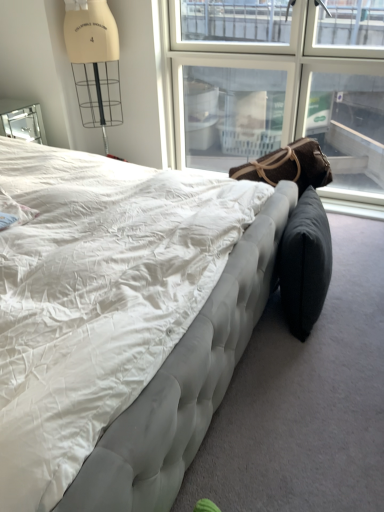
Identify the location of black fabric bean bag chair at lower right, the 2th bean bag chair from the top. (304, 264).

Describe the element at coordinates (304, 264) in the screenshot. I see `black fabric bean bag chair at lower right, the 2th bean bag chair from the top` at that location.

Locate an element on the screen. Image resolution: width=384 pixels, height=512 pixels. tufted fabric bed at center is located at coordinates (102, 297).

Where is `brown fabric bean bag at center, the 1th bean bag chair viewed from the top`? This screenshot has height=512, width=384. brown fabric bean bag at center, the 1th bean bag chair viewed from the top is located at coordinates (289, 166).

Is tufted fabric bed at center completely or partially outside of black fabric bean bag chair at lower right, the 2th bean bag chair from the top?

Indeed, tufted fabric bed at center is completely outside black fabric bean bag chair at lower right, the 2th bean bag chair from the top.

Is point (104, 366) positioned after point (281, 271)?

No, it is in front of (281, 271).

From a real-world perspective, starting from the tufted fabric bed at center, which bean bag chair is the 2nd one below it? Please provide its 2D coordinates.

[(304, 264)]

In the scene shown: Is tufted fabric bed at center positioned with its back to black fabric bean bag chair at lower right, arranged as the first bean bag chair when ordered from the bottom?

No, tufted fabric bed at center is not facing away from black fabric bean bag chair at lower right, arranged as the first bean bag chair when ordered from the bottom.

Does black fabric bean bag chair at lower right, the 2th bean bag chair from the top, have a larger size compared to transparent glass window at upper right?

No, black fabric bean bag chair at lower right, the 2th bean bag chair from the top, is not bigger than transparent glass window at upper right.

In the image, is black fabric bean bag chair at lower right, arranged as the first bean bag chair when ordered from the bottom, on the left side or the right side of transparent glass window at upper right?

From the image, it's evident that black fabric bean bag chair at lower right, arranged as the first bean bag chair when ordered from the bottom, is to the right of transparent glass window at upper right.

Is black fabric bean bag chair at lower right, the 2th bean bag chair from the top, facing away from transparent glass window at upper right?

No, black fabric bean bag chair at lower right, the 2th bean bag chair from the top, is not facing away from transparent glass window at upper right.

Do you think black fabric bean bag chair at lower right, the 2th bean bag chair from the top, is within transparent glass window at upper right, or outside of it?

black fabric bean bag chair at lower right, the 2th bean bag chair from the top, exists outside the volume of transparent glass window at upper right.

Is tufted fabric bed at center positioned with its back to brown fabric bean bag at center, the 1th bean bag chair viewed from the top?

That's not correct — tufted fabric bed at center is not looking away from brown fabric bean bag at center, the 1th bean bag chair viewed from the top.

Is tufted fabric bed at center wider or thinner than brown fabric bean bag at center, which ranks as the second bean bag chair in bottom-to-top order?

In the image, tufted fabric bed at center appears to be wider than brown fabric bean bag at center, which ranks as the second bean bag chair in bottom-to-top order.

Is tufted fabric bed at center taller or shorter than brown fabric bean bag at center, which ranks as the second bean bag chair in bottom-to-top order?

In the image, tufted fabric bed at center appears to be taller than brown fabric bean bag at center, which ranks as the second bean bag chair in bottom-to-top order.

Are brown fabric bean bag at center, which ranks as the second bean bag chair in bottom-to-top order, and tufted fabric bed at center making contact?

No, brown fabric bean bag at center, which ranks as the second bean bag chair in bottom-to-top order, is not with tufted fabric bed at center.

Considering the sizes of brown fabric bean bag at center, which ranks as the second bean bag chair in bottom-to-top order, and tufted fabric bed at center in the image, is brown fabric bean bag at center, which ranks as the second bean bag chair in bottom-to-top order, taller or shorter than tufted fabric bed at center?

Considering their sizes, brown fabric bean bag at center, which ranks as the second bean bag chair in bottom-to-top order, has less height than tufted fabric bed at center.

Is tufted fabric bed at center completely or partially inside brown fabric bean bag at center, the 1th bean bag chair viewed from the top?

No, tufted fabric bed at center is not inside brown fabric bean bag at center, the 1th bean bag chair viewed from the top.

Who is smaller, brown fabric bean bag at center, the 1th bean bag chair viewed from the top, or tufted fabric bed at center?

With smaller size is brown fabric bean bag at center, the 1th bean bag chair viewed from the top.

Is black fabric bean bag chair at lower right, the 2th bean bag chair from the top, outside of tufted fabric bed at center?

Indeed, black fabric bean bag chair at lower right, the 2th bean bag chair from the top, is completely outside tufted fabric bed at center.

From the image's perspective, is black fabric bean bag chair at lower right, arranged as the first bean bag chair when ordered from the bottom, under tufted fabric bed at center?

Yes, from the image's perspective, black fabric bean bag chair at lower right, arranged as the first bean bag chair when ordered from the bottom, is below tufted fabric bed at center.

Can you confirm if black fabric bean bag chair at lower right, the 2th bean bag chair from the top, is taller than tufted fabric bed at center?

In fact, black fabric bean bag chair at lower right, the 2th bean bag chair from the top, may be shorter than tufted fabric bed at center.

From a real-world perspective, is black fabric bean bag chair at lower right, arranged as the first bean bag chair when ordered from the bottom, physically above tufted fabric bed at center?

No, from a real-world perspective, black fabric bean bag chair at lower right, arranged as the first bean bag chair when ordered from the bottom, is not over tufted fabric bed at center

Could you tell me if transparent glass window at upper right is facing black fabric bean bag chair at lower right, the 2th bean bag chair from the top?

Yes, transparent glass window at upper right faces towards black fabric bean bag chair at lower right, the 2th bean bag chair from the top.

From the image's perspective, is transparent glass window at upper right located above black fabric bean bag chair at lower right, arranged as the first bean bag chair when ordered from the bottom?

Yes, from the image's perspective, transparent glass window at upper right is on top of black fabric bean bag chair at lower right, arranged as the first bean bag chair when ordered from the bottom.

Choose the correct answer: Is transparent glass window at upper right inside black fabric bean bag chair at lower right, the 2th bean bag chair from the top, or outside it?

transparent glass window at upper right cannot be found inside black fabric bean bag chair at lower right, the 2th bean bag chair from the top.

Looking at this image, is transparent glass window at upper right shorter than black fabric bean bag chair at lower right, arranged as the first bean bag chair when ordered from the bottom?

No, transparent glass window at upper right is not shorter than black fabric bean bag chair at lower right, arranged as the first bean bag chair when ordered from the bottom.

Is black fabric bean bag chair at lower right, the 2th bean bag chair from the top, surrounded by brown fabric bean bag at center, which ranks as the second bean bag chair in bottom-to-top order?

Definitely not — black fabric bean bag chair at lower right, the 2th bean bag chair from the top, is not inside brown fabric bean bag at center, which ranks as the second bean bag chair in bottom-to-top order.

How much distance is there between brown fabric bean bag at center, which ranks as the second bean bag chair in bottom-to-top order, and black fabric bean bag chair at lower right, the 2th bean bag chair from the top?

brown fabric bean bag at center, which ranks as the second bean bag chair in bottom-to-top order, and black fabric bean bag chair at lower right, the 2th bean bag chair from the top, are 13.52 inches apart.

Looking at this image, is brown fabric bean bag at center, the 1th bean bag chair viewed from the top, positioned far away from black fabric bean bag chair at lower right, the 2th bean bag chair from the top?

No, brown fabric bean bag at center, the 1th bean bag chair viewed from the top, is not far from black fabric bean bag chair at lower right, the 2th bean bag chair from the top.

Where is `the 1st bean bag chair behind when counting from the tufted fabric bed at center`? This screenshot has height=512, width=384. the 1st bean bag chair behind when counting from the tufted fabric bed at center is located at coordinates (304, 264).

From a real-world perspective, count 2nd bean bag chairs downward from the transparent glass window at upper right and point to it. Please provide its 2D coordinates.

[(304, 264)]

Based on their spatial positions, is tufted fabric bed at center or black fabric bean bag chair at lower right, the 2th bean bag chair from the top, further from transparent glass window at upper right?

tufted fabric bed at center lies further to transparent glass window at upper right than the other object.

Which object lies nearer to the anchor point black fabric bean bag chair at lower right, arranged as the first bean bag chair when ordered from the bottom, tufted fabric bed at center or brown fabric bean bag at center, the 1th bean bag chair viewed from the top?

Among the two, brown fabric bean bag at center, the 1th bean bag chair viewed from the top, is located nearer to black fabric bean bag chair at lower right, arranged as the first bean bag chair when ordered from the bottom.

Looking at the image, which one is located closer to tufted fabric bed at center, brown fabric bean bag at center, which ranks as the second bean bag chair in bottom-to-top order, or black fabric bean bag chair at lower right, arranged as the first bean bag chair when ordered from the bottom?

Based on the image, black fabric bean bag chair at lower right, arranged as the first bean bag chair when ordered from the bottom, appears to be nearer to tufted fabric bed at center.

Considering their positions, is transparent glass window at upper right positioned further to tufted fabric bed at center than brown fabric bean bag at center, which ranks as the second bean bag chair in bottom-to-top order?

transparent glass window at upper right.

Based on the photo, estimate the real-world distances between objects in this image. Which object is closer to transparent glass window at upper right, black fabric bean bag chair at lower right, arranged as the first bean bag chair when ordered from the bottom, or tufted fabric bed at center?

black fabric bean bag chair at lower right, arranged as the first bean bag chair when ordered from the bottom, lies closer to transparent glass window at upper right than the other object.

Looking at this image, based on their spatial positions, is transparent glass window at upper right or tufted fabric bed at center closer to brown fabric bean bag at center, which ranks as the second bean bag chair in bottom-to-top order?

tufted fabric bed at center is closer to brown fabric bean bag at center, which ranks as the second bean bag chair in bottom-to-top order.

Estimate the real-world distances between objects in this image. Which object is closer to transparent glass window at upper right, tufted fabric bed at center or brown fabric bean bag at center, which ranks as the second bean bag chair in bottom-to-top order?

Among the two, brown fabric bean bag at center, which ranks as the second bean bag chair in bottom-to-top order, is located nearer to transparent glass window at upper right.

Looking at the image, which one is located closer to black fabric bean bag chair at lower right, the 2th bean bag chair from the top, brown fabric bean bag at center, the 1th bean bag chair viewed from the top, or transparent glass window at upper right?

brown fabric bean bag at center, the 1th bean bag chair viewed from the top, lies closer to black fabric bean bag chair at lower right, the 2th bean bag chair from the top, than the other object.

You are a GUI agent. You are given a task and a screenshot of the screen. Output one action in this format:
    pyautogui.click(x=<x>, y=<y>)
    Task: Click on the bean bag chair between tufted fabric bed at center and brown fabric bean bag at center, which ranks as the second bean bag chair in bottom-to-top order, along the z-axis
    The width and height of the screenshot is (384, 512).
    Given the screenshot: What is the action you would take?
    pyautogui.click(x=304, y=264)

This screenshot has width=384, height=512. Identify the location of bean bag chair between transparent glass window at upper right and black fabric bean bag chair at lower right, the 2th bean bag chair from the top, vertically. (289, 166).